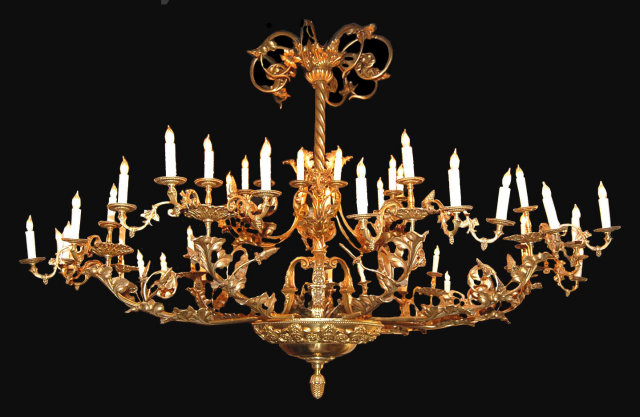
Locate an element on the screen. Image resolution: width=640 pixels, height=417 pixels. the left point of chandelier is located at coordinates (29, 262).